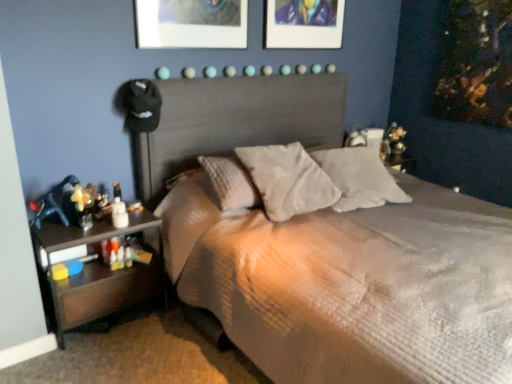
Question: Looking at the image, does textured gray bed at center seem bigger or smaller compared to white soft pillow at center, which is the 1th pillow in right-to-left order?

Choices:
 (A) big
 (B) small

Answer: (A)

Question: Considering the relative positions of textured gray bed at center and white soft pillow at center, which is the 1th pillow in right-to-left order, in the image provided, is textured gray bed at center to the left or to the right of white soft pillow at center, which is the 1th pillow in right-to-left order,?

Choices:
 (A) right
 (B) left

Answer: (A)

Question: Estimate the real-world distances between objects in this image. Which object is farther from the black wood nightstand at lower left?

Choices:
 (A) textured gray bed at center
 (B) metallic silver picture frame at upper center
 (C) white soft pillow at center, which is the 1th pillow in right-to-left order
 (D) textured gray pillow at center, the first pillow when ordered from left to right

Answer: (B)

Question: Which of these objects is positioned farthest from the black wood nightstand at lower left?

Choices:
 (A) white soft pillow at center, which is the 1th pillow in right-to-left order
 (B) textured gray pillow at center, the first pillow when ordered from left to right
 (C) metallic silver picture frame at upper center
 (D) textured gray bed at center

Answer: (C)